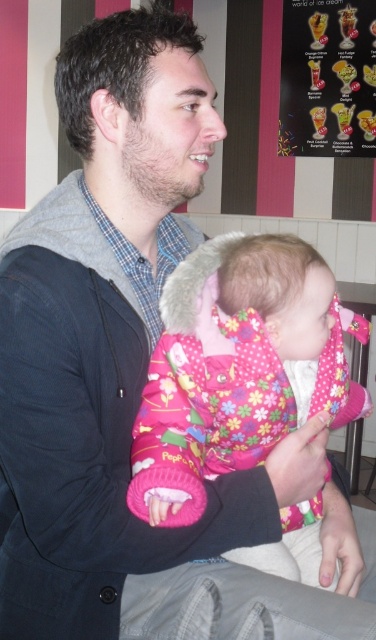
Question: Which point is farther to the camera?

Choices:
 (A) pyautogui.click(x=221, y=346)
 (B) pyautogui.click(x=318, y=129)

Answer: (B)

Question: Is fluffy pink jacket at center to the left of vibrant plastic ice cream cones at upper right from the viewer's perspective?

Choices:
 (A) yes
 (B) no

Answer: (A)

Question: Is fluffy pink jacket at center positioned at the back of vibrant plastic ice cream cones at upper right?

Choices:
 (A) no
 (B) yes

Answer: (A)

Question: Does fluffy pink jacket at center lie behind vibrant plastic ice cream cones at upper right?

Choices:
 (A) no
 (B) yes

Answer: (A)